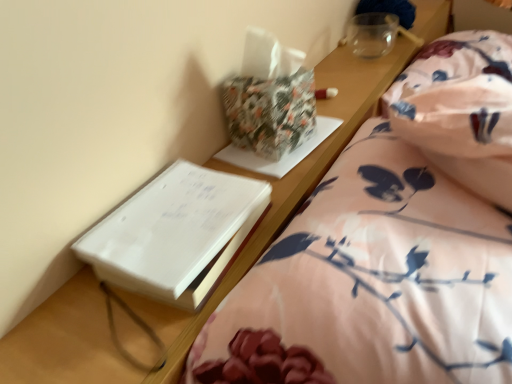
Question: From a real-world perspective, is white paper at left physically below floral cotton blanket at right?

Choices:
 (A) no
 (B) yes

Answer: (A)

Question: Is white paper at left bigger than floral cotton blanket at right?

Choices:
 (A) yes
 (B) no

Answer: (B)

Question: Can you confirm if white paper at left is positioned to the right of floral cotton blanket at right?

Choices:
 (A) no
 (B) yes

Answer: (A)

Question: Can you confirm if white paper at left is thinner than floral cotton blanket at right?

Choices:
 (A) yes
 (B) no

Answer: (A)

Question: Is white paper at left facing away from floral cotton blanket at right?

Choices:
 (A) yes
 (B) no

Answer: (B)

Question: Is floral cotton blanket at right inside the boundaries of floral-patterned paper at upper center, or outside?

Choices:
 (A) inside
 (B) outside

Answer: (B)

Question: In terms of width, does floral cotton blanket at right look wider or thinner when compared to floral-patterned paper at upper center?

Choices:
 (A) thin
 (B) wide

Answer: (B)

Question: In terms of height, does floral cotton blanket at right look taller or shorter compared to floral-patterned paper at upper center?

Choices:
 (A) tall
 (B) short

Answer: (A)

Question: In the image, is floral cotton blanket at right on the left side or the right side of floral-patterned paper at upper center?

Choices:
 (A) right
 (B) left

Answer: (A)

Question: Considering the positions of point (267, 43) and point (492, 142), is point (267, 43) closer or farther from the camera than point (492, 142)?

Choices:
 (A) farther
 (B) closer

Answer: (A)

Question: From the image's perspective, is floral-patterned paper at upper center positioned above or below floral cotton blanket at right?

Choices:
 (A) above
 (B) below

Answer: (B)

Question: From a real-world perspective, is floral-patterned paper at upper center above or below floral cotton blanket at right?

Choices:
 (A) below
 (B) above

Answer: (B)

Question: Is floral-patterned paper at upper center taller or shorter than floral cotton blanket at right?

Choices:
 (A) short
 (B) tall

Answer: (A)

Question: Considering the positions of white paper at left and floral-patterned paper at upper center in the image, is white paper at left bigger or smaller than floral-patterned paper at upper center?

Choices:
 (A) big
 (B) small

Answer: (B)

Question: From the image's perspective, relative to floral-patterned paper at upper center, is white paper at left above or below?

Choices:
 (A) above
 (B) below

Answer: (B)